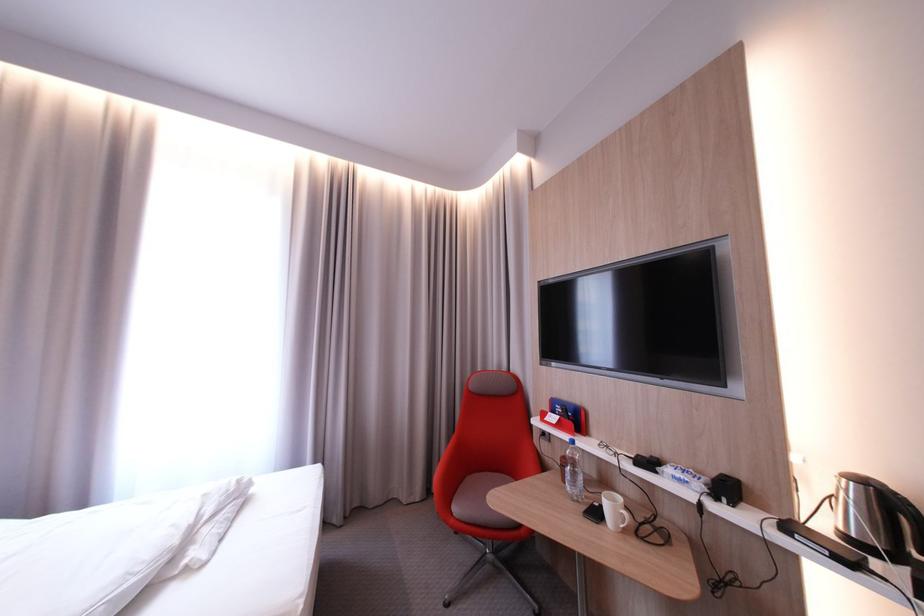
Find the location of a particular element. The width and height of the screenshot is (924, 616). red chair sitting surface is located at coordinates (478, 496).